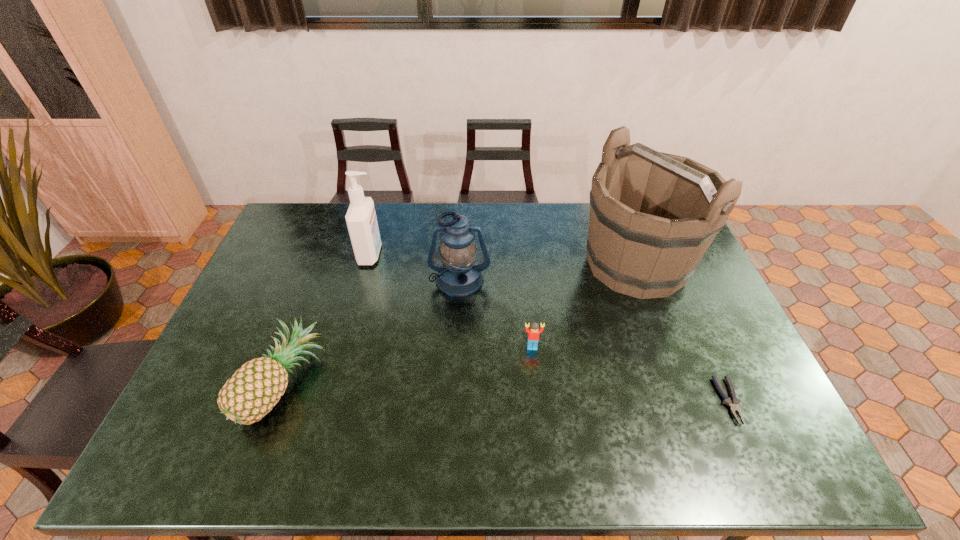
At what (x,y) coordinates should I click in order to perform the action: click on blank space that satisfies the following two spatial constraints: 1. on the front label of the bucket; 2. on the right side of the cleansing agent. Please return your answer as a coordinate pair (x, y). This screenshot has height=540, width=960. Looking at the image, I should click on (369, 264).

Locate an element on the screen. The image size is (960, 540). vacant space that satisfies the following two spatial constraints: 1. on the front label of the cleansing agent; 2. on the left side of the tallest object is located at coordinates (369, 264).